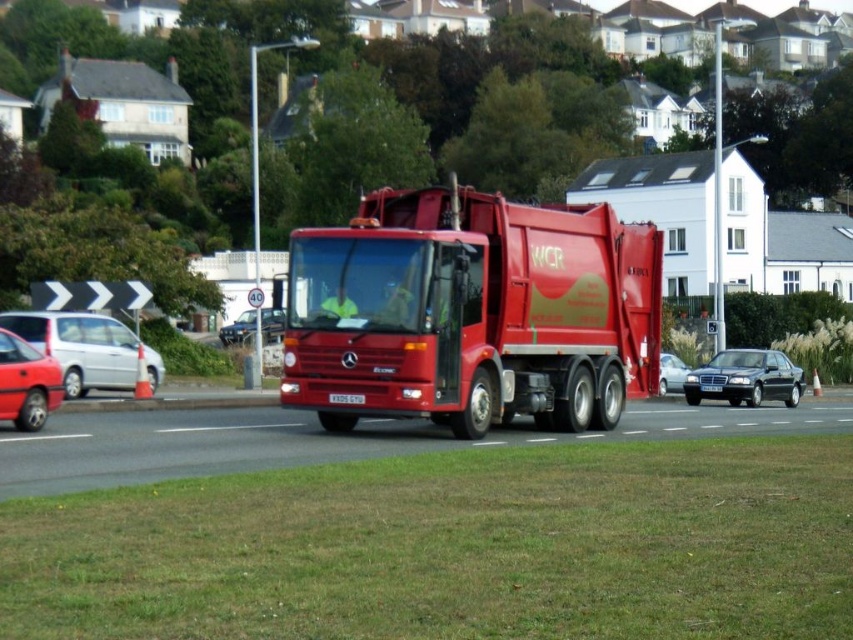
Between point (224, 332) and point (703, 385), which one is positioned in front?

Positioned in front is point (703, 385).

Does metallic silver car at center have a larger size compared to black plastic license plate at center?

Yes.

Between point (253, 320) and point (717, 388), which one is positioned in front?

Point (717, 388)

Locate an element on the screen. The width and height of the screenshot is (853, 640). metallic silver car at center is located at coordinates (238, 328).

Identify the location of metallic silver car at center. The height and width of the screenshot is (640, 853). (238, 328).

Can you confirm if metallic silver car at center is positioned below whitemetalliclicense plate at center?

Actually, metallic silver car at center is above whitemetalliclicense plate at center.

This screenshot has width=853, height=640. I want to click on metallic silver car at center, so click(x=238, y=328).

Is shiny red truck at center wider than shiny black sedan at center?

No.

Who is higher up, shiny red truck at center or shiny black sedan at center?

shiny red truck at center is higher up.

Between point (636, 304) and point (780, 380), which one is positioned behind?

Positioned behind is point (780, 380).

At what (x,y) coordinates should I click in order to perform the action: click on shiny red truck at center. Please return your answer as a coordinate pair (x, y). Image resolution: width=853 pixels, height=640 pixels. Looking at the image, I should click on (473, 312).